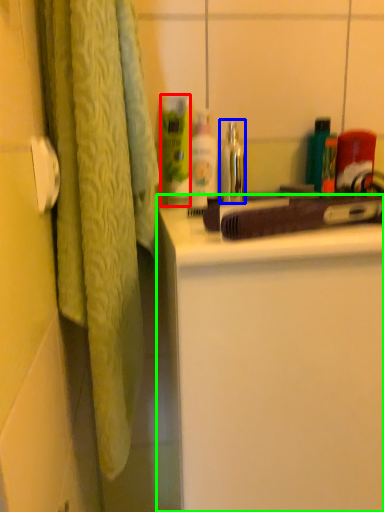
Question: Which object is positioned closest to cleaning product (highlighted by a red box)? Select from faucet (highlighted by a blue box) and bathroom cabinet (highlighted by a green box).

Choices:
 (A) faucet
 (B) bathroom cabinet

Answer: (A)